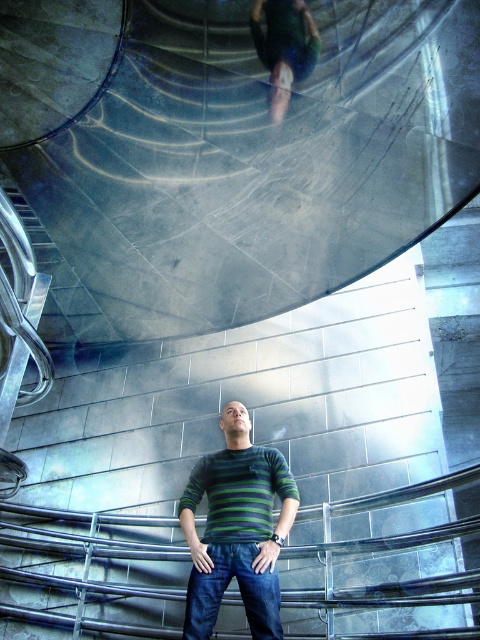
You are a fashion designer observing a model wearing the green striped sweater at center and dark blue denim jeans at center. Which piece of clothing is positioned more to the right side of the model?

The green striped sweater at center is positioned more to the right side of the model than the dark blue denim jeans at center.

Looking at this image, you are an interior designer assessing the space for a new art installation. You have a green fabric skateboard at upper center and a green striped sweater at center. Which object takes up more space in the visual composition?

The green striped sweater at center takes up more space in the visual composition as it is larger in size compared to the green fabric skateboard at upper center.